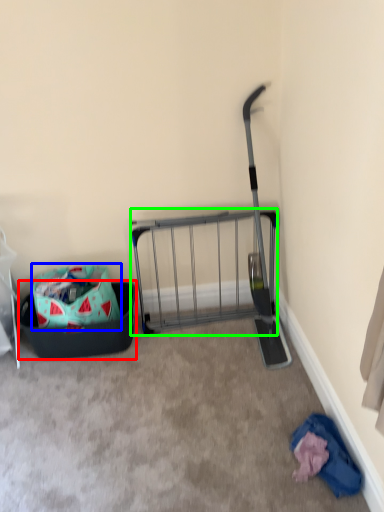
Question: Estimate the real-world distances between objects in this image. Which object is farther from laundry basket (highlighted by a red box), bag (highlighted by a blue box) or cart (highlighted by a green box)?

Choices:
 (A) bag
 (B) cart

Answer: (B)